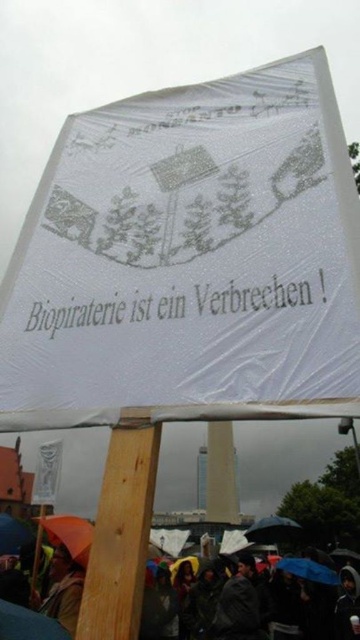
Question: Which object is closer to the camera taking this photo?

Choices:
 (A) blue fabric umbrella at lower center
 (B) raincoats at lower center
 (C) white plastic sign at center
 (D) raincoat at lower left

Answer: (B)

Question: Can you confirm if white plastic sign at center is bigger than raincoats at lower center?

Choices:
 (A) yes
 (B) no

Answer: (B)

Question: Which point appears closest to the camera in this image?

Choices:
 (A) (62, 525)
 (B) (263, 528)
 (C) (120, 163)

Answer: (C)

Question: Can you confirm if raincoats at lower center is bigger than raincoat at lower left?

Choices:
 (A) yes
 (B) no

Answer: (A)

Question: Is white plastic sign at center in front of blue fabric umbrella at lower center?

Choices:
 (A) no
 (B) yes

Answer: (B)

Question: Which point is farther from the camera taking this photo?

Choices:
 (A) (210, 324)
 (B) (312, 561)
 (C) (81, 540)
 (D) (52, 589)

Answer: (B)